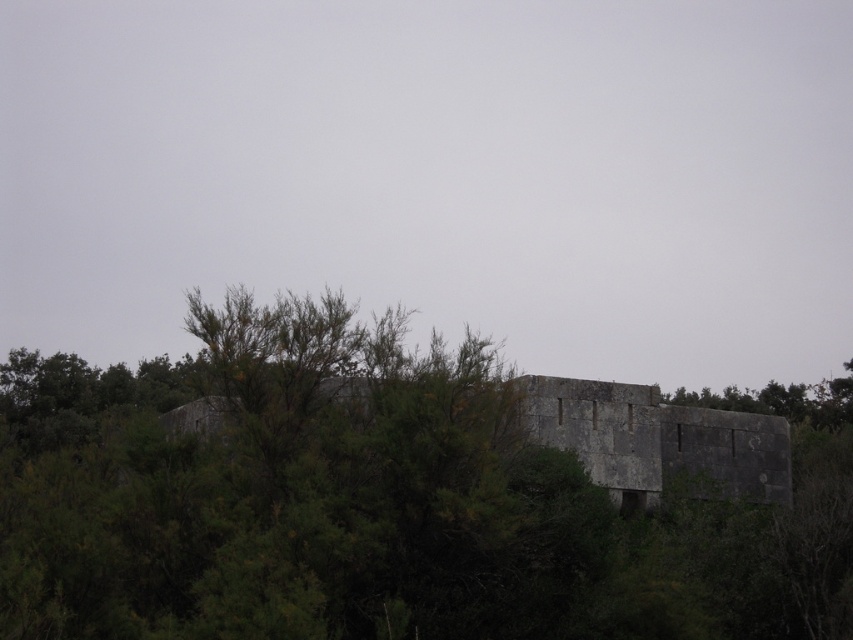
Question: Which point appears closest to the camera in this image?

Choices:
 (A) (656, 458)
 (B) (372, 522)

Answer: (B)

Question: Which object appears farthest from the camera in this image?

Choices:
 (A) gray stone fort at center
 (B) green leafy tree at center

Answer: (A)

Question: Can you confirm if green leafy tree at center is positioned below gray stone fort at center?

Choices:
 (A) no
 (B) yes

Answer: (B)

Question: Does green leafy tree at center have a smaller size compared to gray stone fort at center?

Choices:
 (A) no
 (B) yes

Answer: (A)

Question: Which point appears farthest from the camera in this image?

Choices:
 (A) (618, 397)
 (B) (685, 532)

Answer: (A)

Question: Is green leafy tree at center positioned behind gray stone fort at center?

Choices:
 (A) no
 (B) yes

Answer: (A)